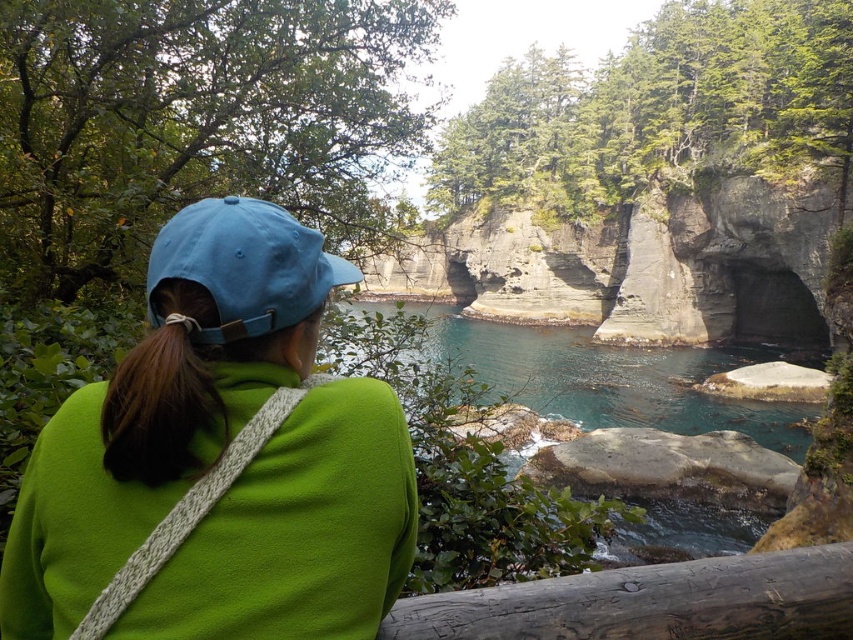
Based on the photo, is wooden rail at lower center bigger than blue fabric cap at upper left?

Indeed, wooden rail at lower center has a larger size compared to blue fabric cap at upper left.

You are a GUI agent. You are given a task and a screenshot of the screen. Output one action in this format:
    pyautogui.click(x=<x>, y=<y>)
    Task: Click on the wooden rail at lower center
    Image resolution: width=853 pixels, height=640 pixels.
    Given the screenshot: What is the action you would take?
    pyautogui.click(x=651, y=602)

Does matte blue cap at upper left appear over blue fabric cap at upper left?

No.

Based on the photo, which is more to the left, matte blue cap at upper left or blue fabric cap at upper left?

From the viewer's perspective, blue fabric cap at upper left appears more on the left side.

What do you see at coordinates (218, 460) in the screenshot?
I see `matte blue cap at upper left` at bounding box center [218, 460].

What are the coordinates of `matte blue cap at upper left` in the screenshot? It's located at [218, 460].

From the picture: Is wooden rail at lower center wider than brown hair at back?

Yes.

Does wooden rail at lower center have a lesser height compared to brown hair at back?

Indeed, wooden rail at lower center has a lesser height compared to brown hair at back.

Is point (704, 564) in front of point (163, 465)?

No, (704, 564) is further to viewer.

Image resolution: width=853 pixels, height=640 pixels. Find the location of `wooden rail at lower center`. wooden rail at lower center is located at coordinates coord(651,602).